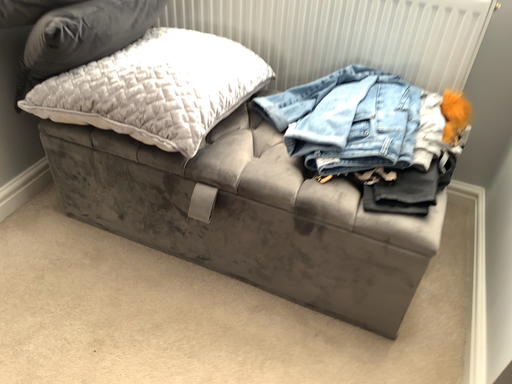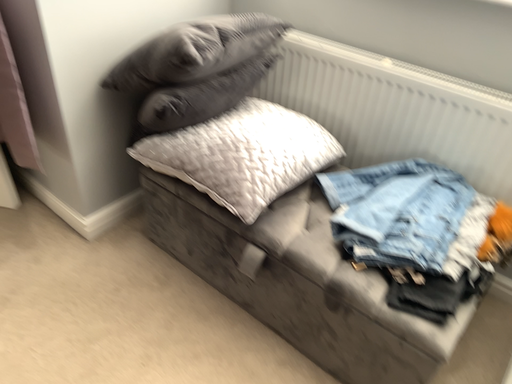
Question: Which way did the camera rotate in the video?

Choices:
 (A) rotated right
 (B) rotated left

Answer: (B)